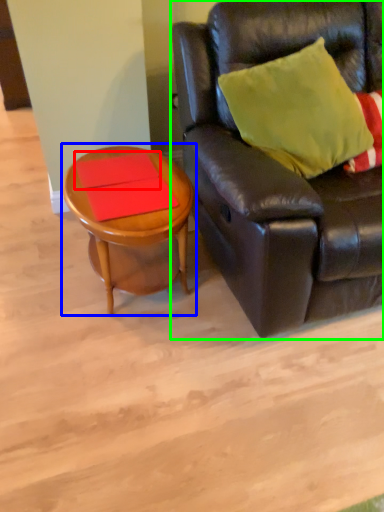
Question: Which is farther away from plank (highlighted by a red box)? coffee table (highlighted by a blue box) or studio couch (highlighted by a green box)?

Choices:
 (A) coffee table
 (B) studio couch

Answer: (B)